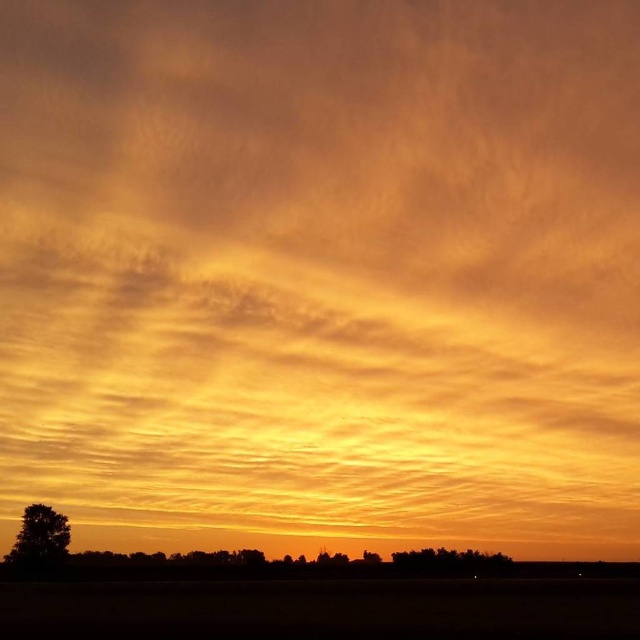
Is silhouette tree at lower left in front of silhouette tree at lower center?

No, it is not.

Does silhouette tree at lower left have a larger size compared to silhouette tree at lower center?

No.

What do you see at coordinates (38, 538) in the screenshot?
I see `silhouette tree at lower left` at bounding box center [38, 538].

Identify the location of silhouette tree at lower left. (38, 538).